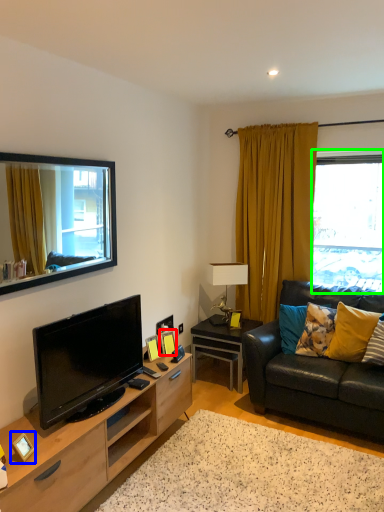
Question: Which object is positioned farthest from picture frame (highlighted by a red box)? Select from picture frame (highlighted by a blue box) and window (highlighted by a green box).

Choices:
 (A) picture frame
 (B) window

Answer: (B)